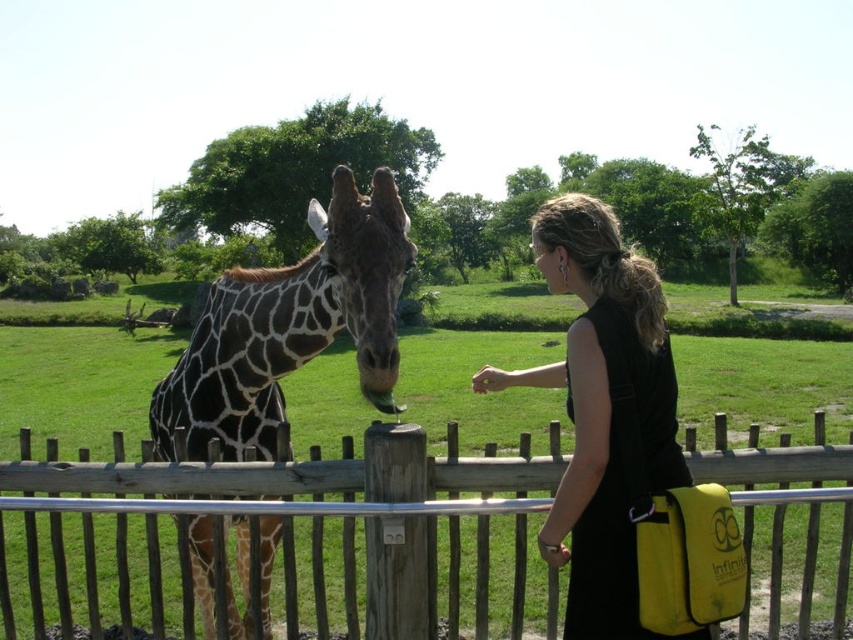
In the scene shown: Does wooden fence at center have a greater height compared to black fabric dress at center?

Incorrect, wooden fence at center's height is not larger of black fabric dress at center's.

Who is taller, wooden fence at center or black fabric dress at center?

black fabric dress at center

Locate an element on the screen. wooden fence at center is located at coordinates (280, 534).

Which is more to the right, spotted fur giraffe at center or black fabric dress at center?

black fabric dress at center

Is the position of spotted fur giraffe at center less distant than that of black fabric dress at center?

No, it is not.

The image size is (853, 640). In order to click on spotted fur giraffe at center in this screenshot , I will do `click(289, 326)`.

Locate an element on the screen. spotted fur giraffe at center is located at coordinates 289,326.

Who is positioned more to the right, wooden fence at center or spotted fur giraffe at center?

spotted fur giraffe at center is more to the right.

Where is `wooden fence at center`? This screenshot has height=640, width=853. wooden fence at center is located at coordinates (280, 534).

This screenshot has height=640, width=853. What do you see at coordinates (280, 534) in the screenshot?
I see `wooden fence at center` at bounding box center [280, 534].

This screenshot has width=853, height=640. I want to click on wooden fence at center, so click(280, 534).